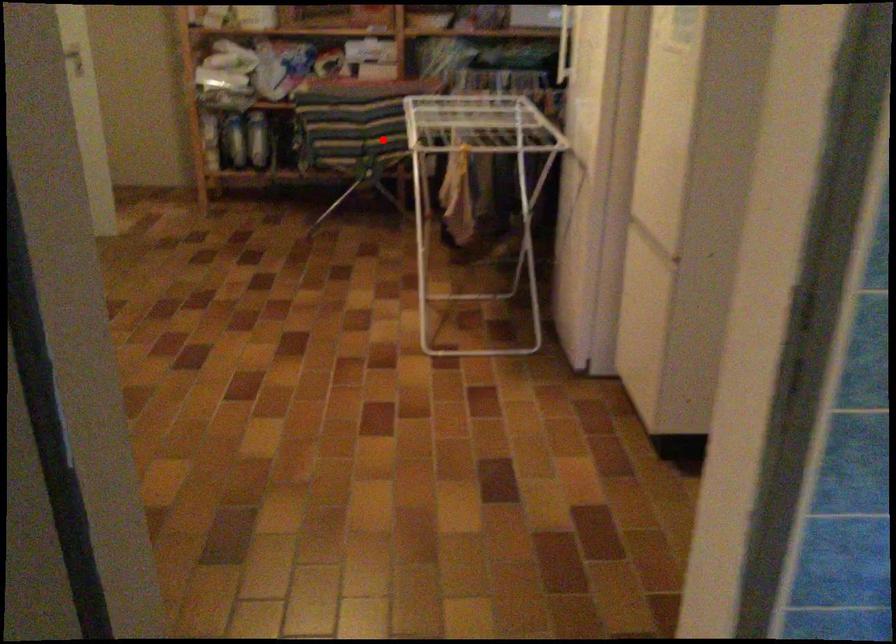
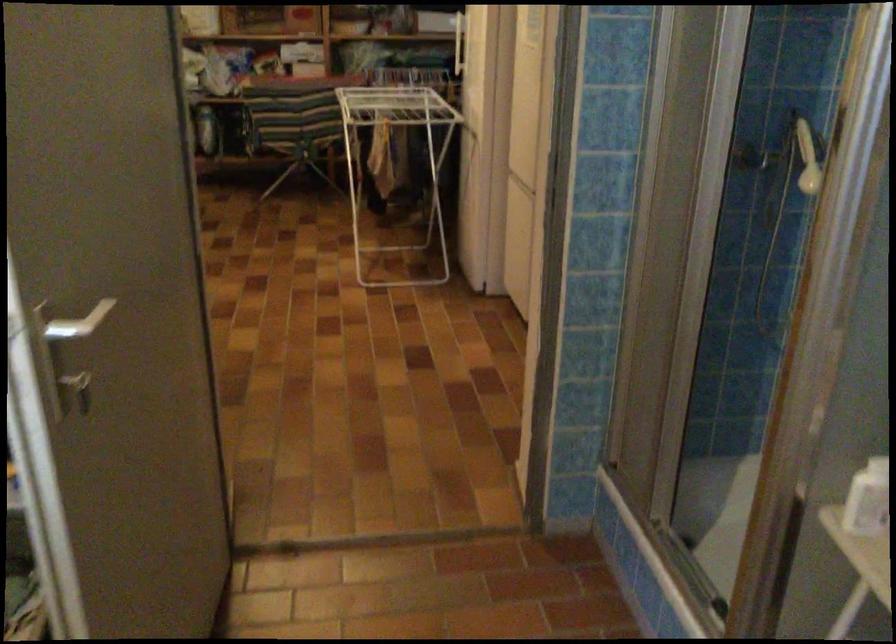
Question: I am providing you with two images of the same scene from different viewpoints. In image1, a red point is highlighted. Considering the same 3D point in image2, which of the following is correct?

Choices:
 (A) It is closer
 (B) It is farther

Answer: (B)